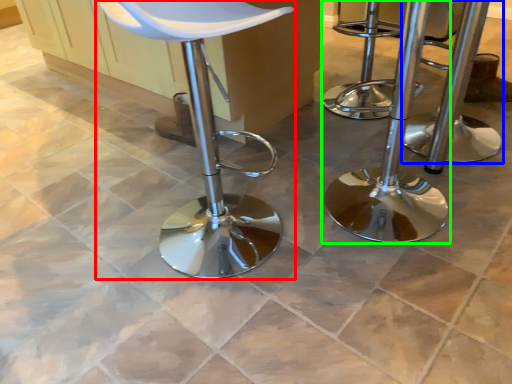
Question: Estimate the real-world distances between objects in this image. Which object is closer to chair (highlighted by a red box), stool (highlighted by a blue box) or stool (highlighted by a green box)?

Choices:
 (A) stool
 (B) stool

Answer: (B)